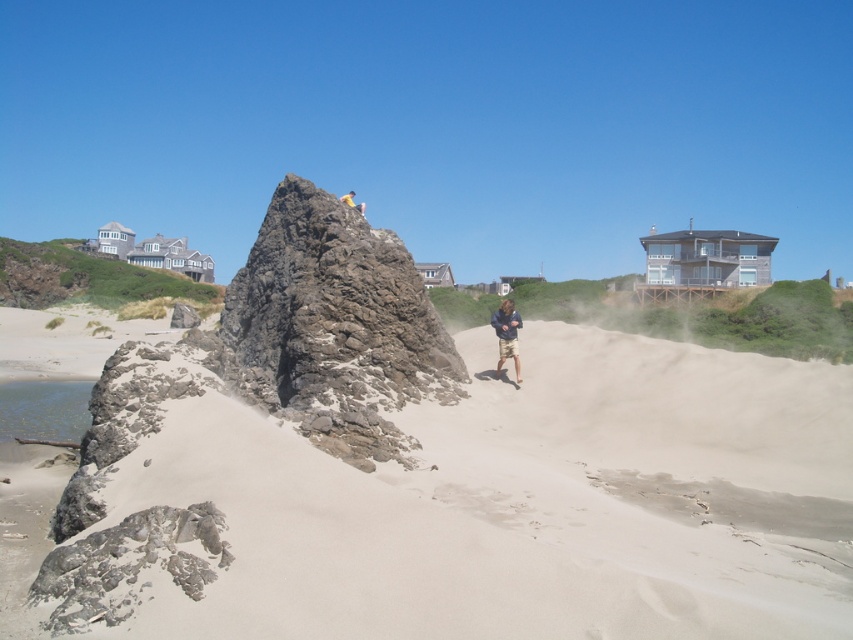
You are a hiker who wants to climb up the brown rough rock at center. The smooth beige sand at center is below it. Do you think the sand will provide a stable base for your climb?

The smooth beige sand at center is below the brown rough rock at center, but since the sand is described as soft and loose with erosion signs, it may not provide a stable base for climbing the rock. Look for firmer ground nearby.

You are standing at the point with coordinates 0.6, 0.5. You want to walk to the smooth beige sand at center. In which direction should you move?

You should move to the right and slightly upward because the smooth beige sand at center is located at coordinates (460, 502), which is to the right and slightly above your current position at (426, 384).

You are standing at the point marked by coordinates point (x=334, y=326) in the beach scene. What object are you currently standing on?

The point (x=334, y=326) marks the brown rough rock at center, so you are standing on the brown rough rock at center.